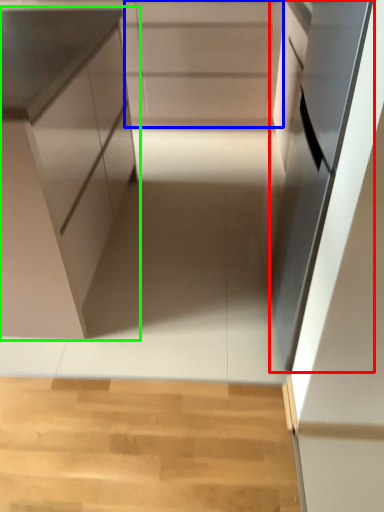
Question: Based on their relative distances, which object is farther from oven (highlighted by a red box)? Choose from cabinetry (highlighted by a blue box) and cabinetry (highlighted by a green box).

Choices:
 (A) cabinetry
 (B) cabinetry

Answer: (A)